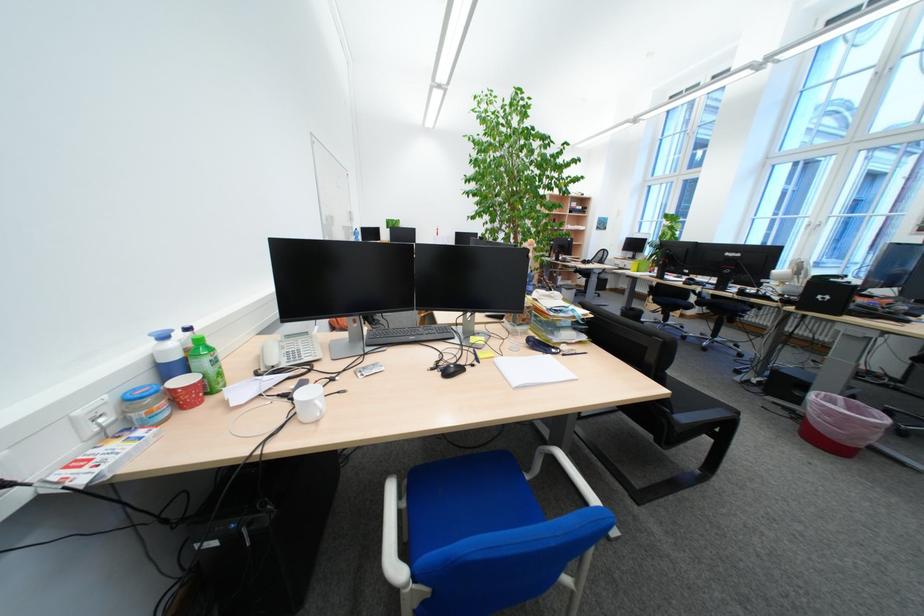
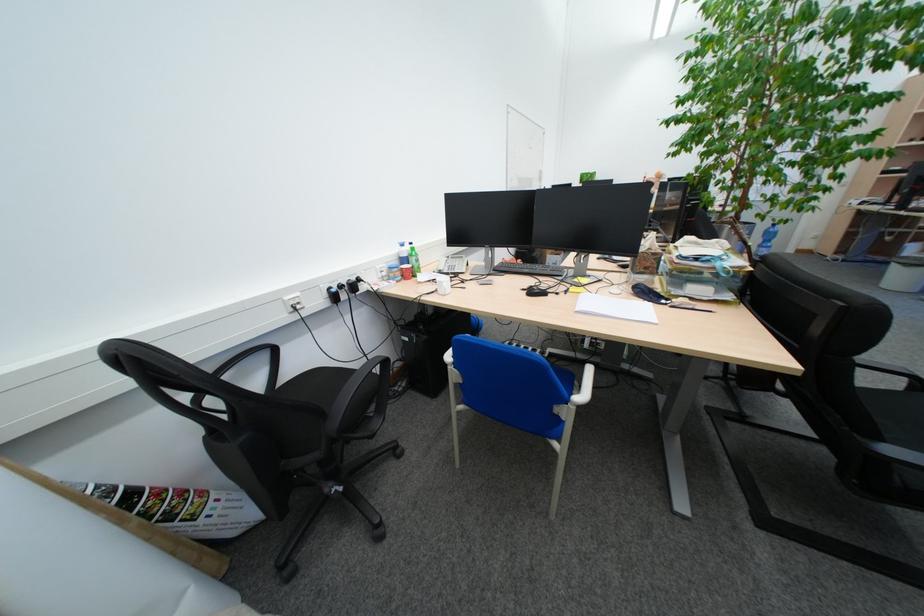
Question: The images are taken continuously from a first-person perspective. In which direction is your viewpoint rotating?

Choices:
 (A) Left
 (B) Right
 (C) Up
 (D) Down

Answer: (A)